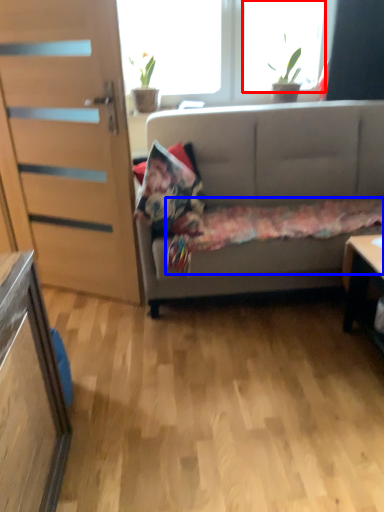
Question: Which object appears closest to the camera in this image, window (highlighted by a red box) or bedding (highlighted by a blue box)?

Choices:
 (A) window
 (B) bedding

Answer: (B)